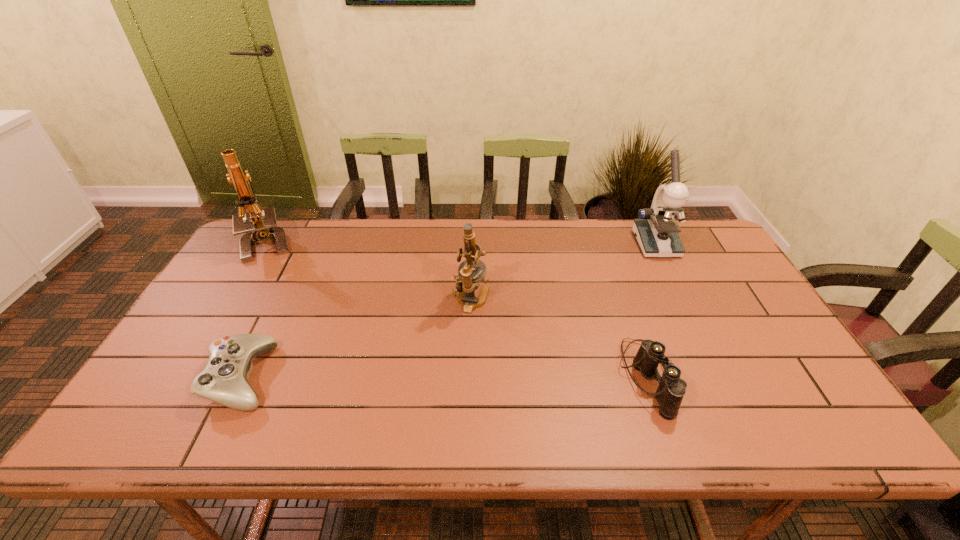
Where is `free spot between the leftmost microscope and the binoculars`? free spot between the leftmost microscope and the binoculars is located at coordinates (458, 310).

Locate an element on the screen. Image resolution: width=960 pixels, height=540 pixels. free space between the third object from right to left and the rightmost object is located at coordinates (564, 272).

The height and width of the screenshot is (540, 960). What are the coordinates of `vacant area that lies between the leftmost microscope and the rightmost object` in the screenshot? It's located at (462, 244).

Identify the location of vacant area that lies between the leftmost microscope and the rightmost microscope. Image resolution: width=960 pixels, height=540 pixels. (462, 244).

This screenshot has width=960, height=540. I want to click on vacant point located between the rightmost microscope and the second microscope from right to left, so click(x=564, y=272).

The height and width of the screenshot is (540, 960). I want to click on object identified as the fourth closest to the control, so click(x=656, y=230).

Locate an element on the screen. object that stands as the third closest to the leftmost microscope is located at coordinates (671, 389).

Where is `the closest microscope to the third farthest object`? This screenshot has width=960, height=540. the closest microscope to the third farthest object is located at coordinates (656, 230).

Where is `microscope that is the closest one to the control`? The width and height of the screenshot is (960, 540). microscope that is the closest one to the control is located at coordinates (264, 226).

Identify the location of free space in the image that satisfies the following two spatial constraints: 1. at the eyepiece of the rightmost microscope; 2. on the right side of the leftmost microscope. (268, 244).